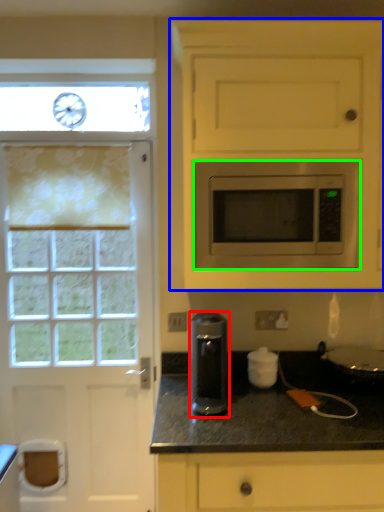
Question: Which object is the closest to the kitchen appliance (highlighted by a red box)? Choose among these: cabinetry (highlighted by a blue box) or microwave oven (highlighted by a green box).

Choices:
 (A) cabinetry
 (B) microwave oven

Answer: (B)